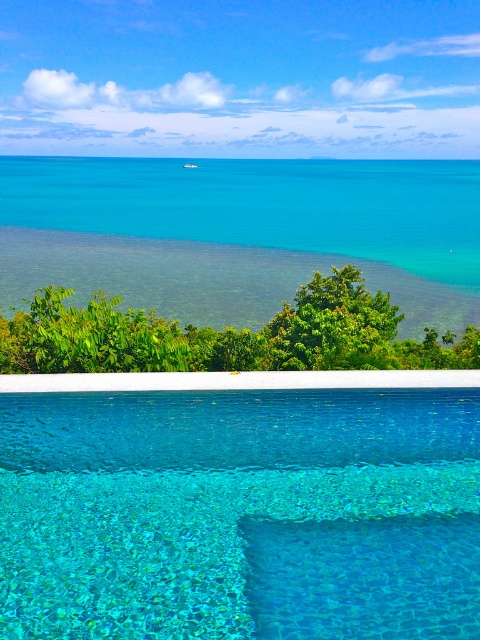
Question: Can you confirm if transparent glass pool at center is bigger than clear blue water at center?

Choices:
 (A) no
 (B) yes

Answer: (A)

Question: Does transparent glass pool at center have a smaller size compared to clear blue water at center?

Choices:
 (A) no
 (B) yes

Answer: (B)

Question: Where is transparent glass pool at center located in relation to clear blue water at center in the image?

Choices:
 (A) above
 (B) below

Answer: (B)